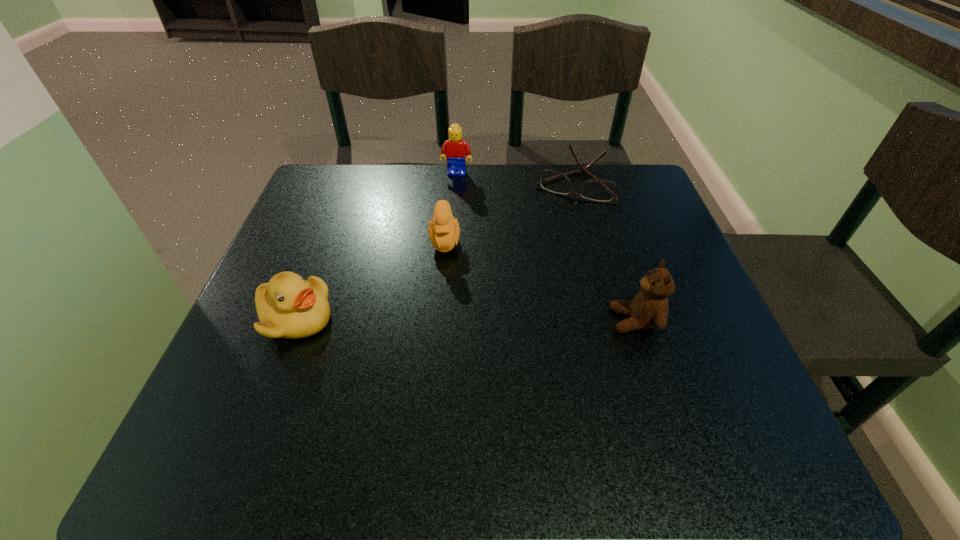
Image resolution: width=960 pixels, height=540 pixels. Identify the location of free area in between the shortest object and the left duckling. (434, 251).

You are a GUI agent. You are given a task and a screenshot of the screen. Output one action in this format:
    pyautogui.click(x=<x>, y=<y>)
    Task: Click on the free spot between the Lego and the spectacles
    This screenshot has width=960, height=540.
    Given the screenshot: What is the action you would take?
    pyautogui.click(x=515, y=178)

Select which object is the closest to the spectacles. Please provide its 2D coordinates. Your answer should be formatted as a tuple, i.e. [(x, y)], where the tuple contains the x and y coordinates of a point satisfying the conditions above.

[(456, 149)]

This screenshot has width=960, height=540. I want to click on object identified as the third closest to the left duckling, so click(598, 190).